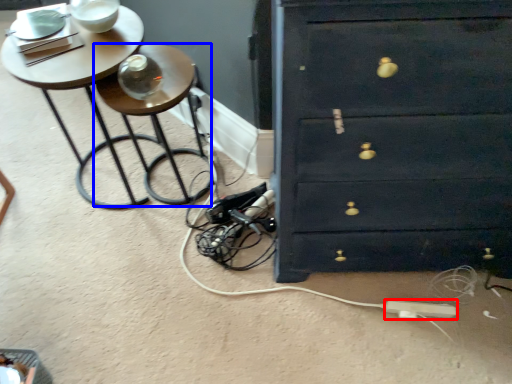
Question: Which object appears farthest to the camera in this image, extension cord (highlighted by a red box) or side table (highlighted by a blue box)?

Choices:
 (A) extension cord
 (B) side table

Answer: (A)